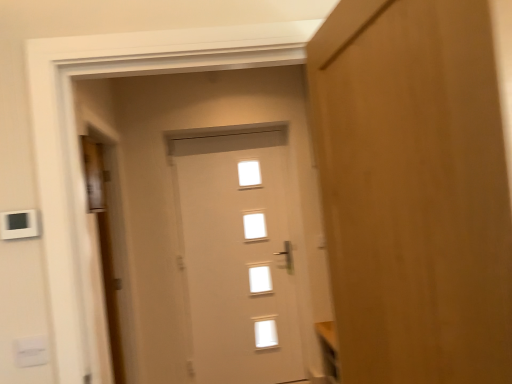
Question: From a real-world perspective, is wooden door at right, which ranks as the first door in right-to-left order, positioned above or below white plastic light switch at lower left, which ranks as the second light switch in top-to-bottom order?

Choices:
 (A) above
 (B) below

Answer: (A)

Question: Visually, is wooden door at right, the 3th door in the back-to-front sequence, positioned to the left or to the right of white plastic light switch at lower left, which ranks as the second light switch in top-to-bottom order?

Choices:
 (A) left
 (B) right

Answer: (B)

Question: Estimate the real-world distances between objects in this image. Which object is closer to the white plastic light switch at lower left, which ranks as the second light switch in top-to-bottom order?

Choices:
 (A) white plastic light switch at upper left, positioned as the first light switch in top-to-bottom order
 (B) wooden door at left, the second door when ordered from front to back
 (C) wooden door at right, which is counted as the first door, starting from the front
 (D) white glossy door at center, marked as the 3th door in a front-to-back arrangement

Answer: (A)

Question: Considering the real-world distances, which object is closest to the white glossy door at center, marked as the 3th door in a front-to-back arrangement?

Choices:
 (A) white plastic light switch at lower left, which ranks as the second light switch in top-to-bottom order
 (B) wooden door at right, which is counted as the first door, starting from the front
 (C) white plastic light switch at upper left, the 2th light switch ordered from the bottom
 (D) wooden door at left, marked as the third door in a right-to-left arrangement

Answer: (D)